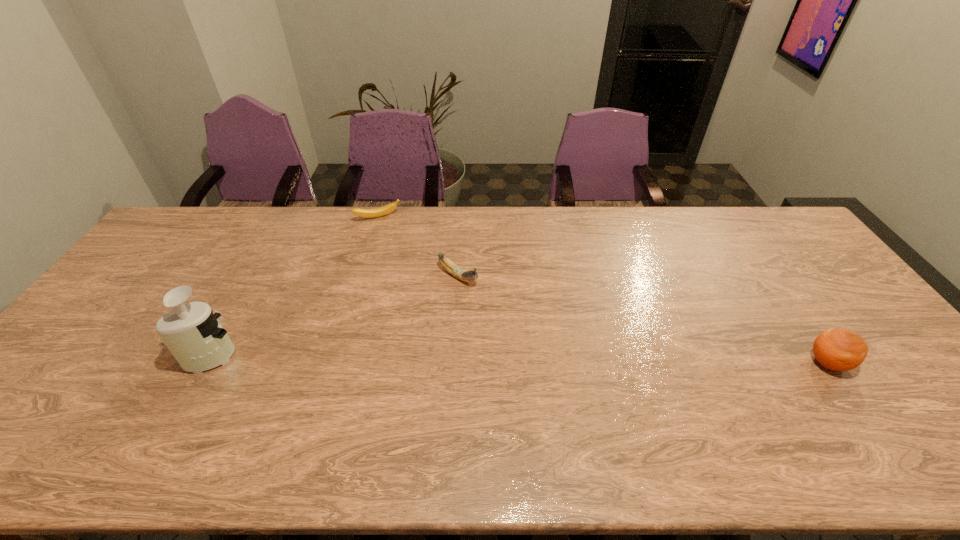
The width and height of the screenshot is (960, 540). I want to click on empty location between the juicer and the shorter banana, so pos(296,286).

The width and height of the screenshot is (960, 540). What are the coordinates of `free space between the second tallest object and the shorter banana` in the screenshot? It's located at (603, 291).

Locate an element on the screen. The width and height of the screenshot is (960, 540). vacant area that lies between the right banana and the rightmost object is located at coordinates (643, 320).

The image size is (960, 540). I want to click on object that is the second closest one to the third nearest object, so click(x=192, y=333).

Where is `object that ranks as the second closest to the orange`? object that ranks as the second closest to the orange is located at coordinates (377, 212).

In order to click on vacant point that satisfies the following two spatial constraints: 1. on the back side of the third nearest object; 2. on the left side of the leftmost object in this screenshot , I will do `click(256, 277)`.